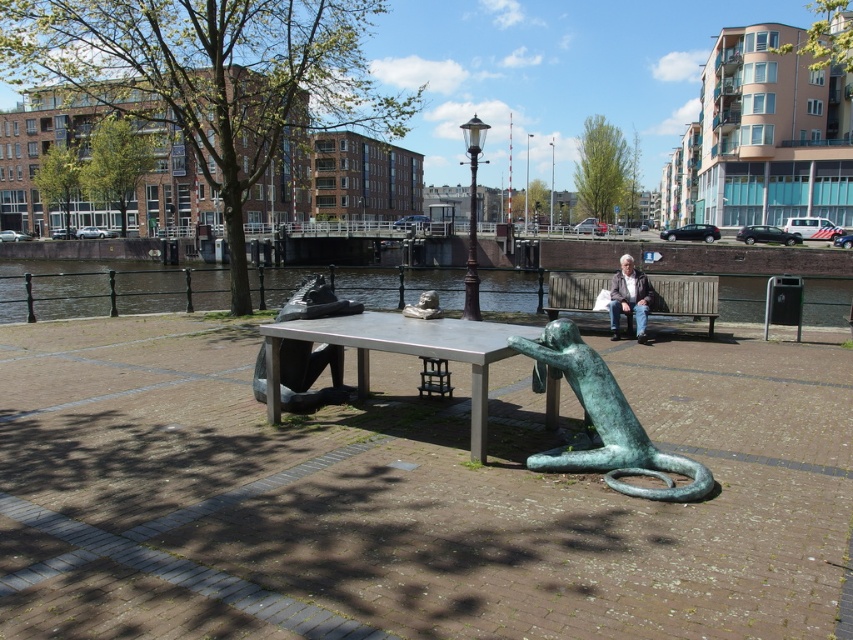
Question: Which object is the farthest from the green patina water at center?

Choices:
 (A) wooden bench at center
 (B) matte brown jacket at center

Answer: (B)

Question: Is polished stone statue at center above matte brown jacket at center?

Choices:
 (A) yes
 (B) no

Answer: (B)

Question: Which object appears closest to the camera in this image?

Choices:
 (A) metallic silver table at center
 (B) matte brown jacket at center
 (C) green patina bronze monkey at lower center

Answer: (C)

Question: Observing the image, what is the correct spatial positioning of green patina bronze monkey at lower center in reference to wooden bench at center?

Choices:
 (A) left
 (B) right

Answer: (A)

Question: Can you confirm if green patina water at center is wider than matte brown jacket at center?

Choices:
 (A) no
 (B) yes

Answer: (B)

Question: Which point is farther to the camera?

Choices:
 (A) metallic silver table at center
 (B) green patina water at center
 (C) wooden bench at center

Answer: (B)